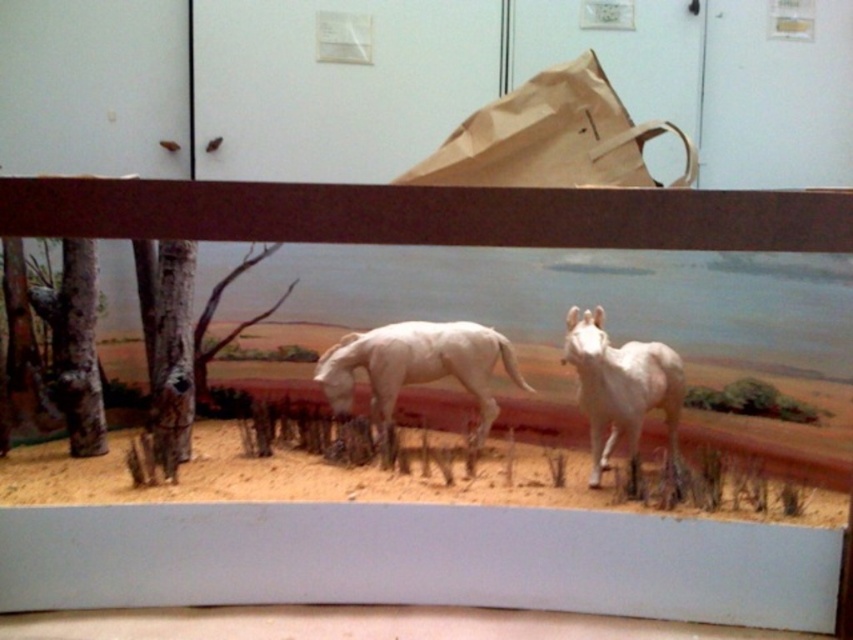
You are a visitor at a museum and see the brown paper bag at upper center and the white matte horse at center in the diorama. Which object is positioned to the right side of the other?

The brown paper bag at upper center is to the right of the white matte horse at center.

From the picture: You are a visitor at a museum exhibit and see the brown paper bag at upper center and the white glossy horse at center. Which object is positioned to the left of the other?

The brown paper bag at upper center is to the left of the white glossy horse at center according to the description.